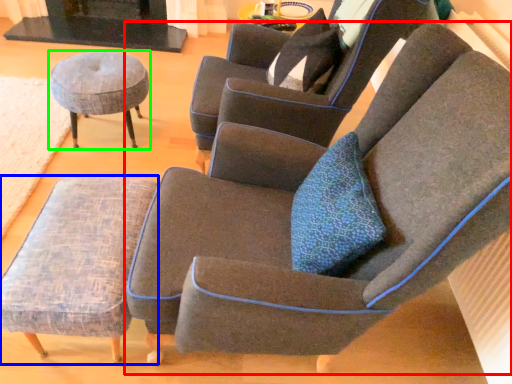
Question: Which object is the closest to the chair (highlighted by a red box)? Choose among these: stool (highlighted by a blue box) or stool (highlighted by a green box).

Choices:
 (A) stool
 (B) stool

Answer: (A)